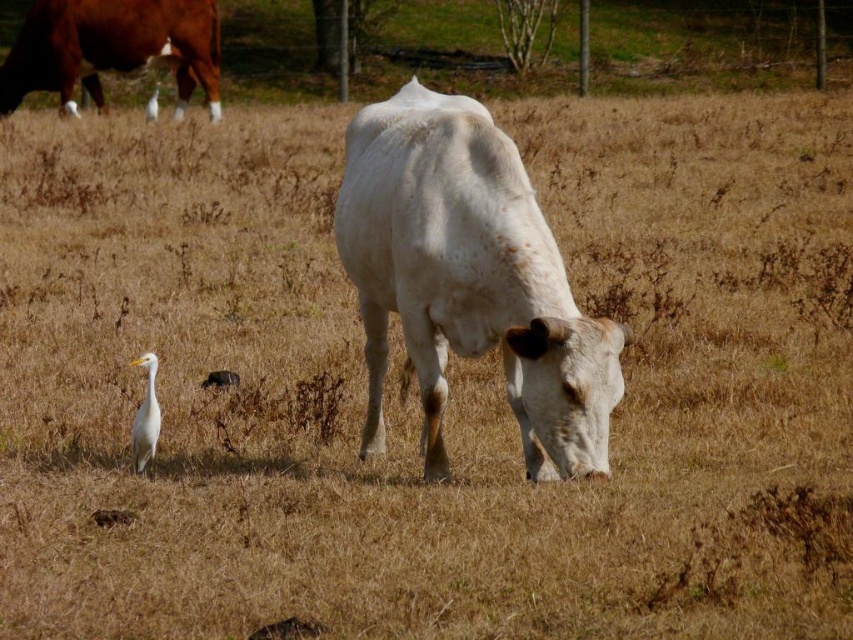
Question: Which point is farther to the camera?

Choices:
 (A) [520, 224]
 (B) [149, 451]

Answer: (B)

Question: Where is white smooth cow at center located in relation to white feathered bird at lower left in the image?

Choices:
 (A) left
 (B) right

Answer: (B)

Question: Is white smooth cow at center bigger than brown glossy bull at upper left?

Choices:
 (A) yes
 (B) no

Answer: (B)

Question: Can you confirm if brown glossy bull at upper left is positioned above white feathered bird at lower left?

Choices:
 (A) no
 (B) yes

Answer: (B)

Question: Which object is closer to the camera taking this photo?

Choices:
 (A) white feathered bird at lower left
 (B) brown glossy bull at upper left
 (C) white smooth cow at center

Answer: (C)

Question: Which is nearer to the white feathered bird at lower left?

Choices:
 (A) brown glossy bull at upper left
 (B) white smooth cow at center

Answer: (B)